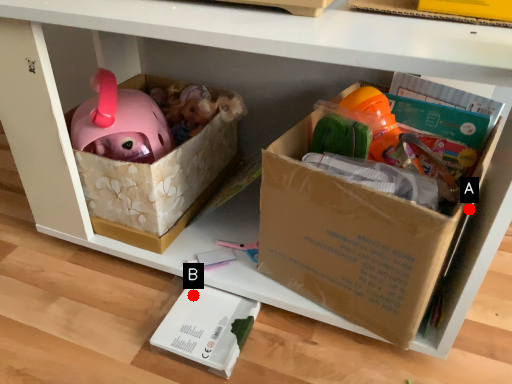
Question: Two points are circled on the image, labeled by A and B beside each circle. Which of the following is the farthest from the observer?

Choices:
 (A) A is further
 (B) B is further

Answer: (B)